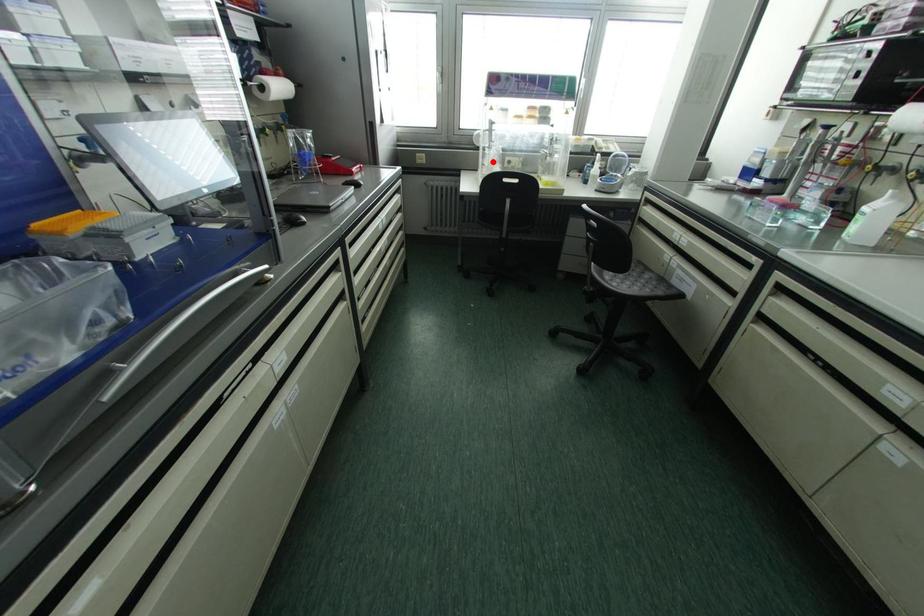
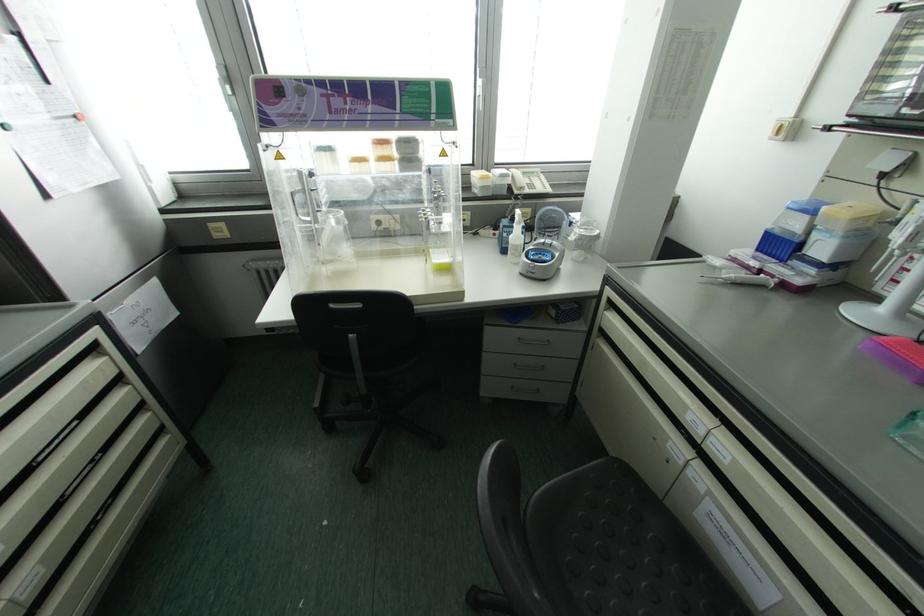
Where in the second image is the point corresponding to the highlighted location from the first image?

(334, 238)